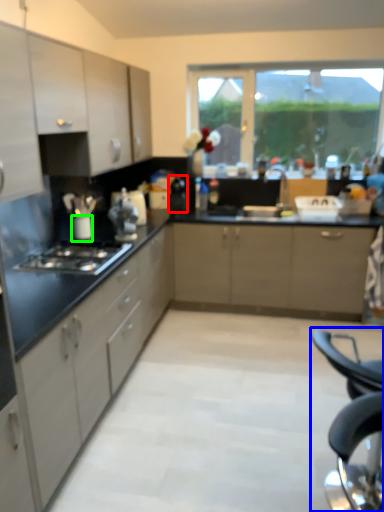
Question: Considering the real-world distances, which object is closest to appliance (highlighted by a red box)? folding chair (highlighted by a blue box) or appliance (highlighted by a green box).

Choices:
 (A) folding chair
 (B) appliance

Answer: (B)